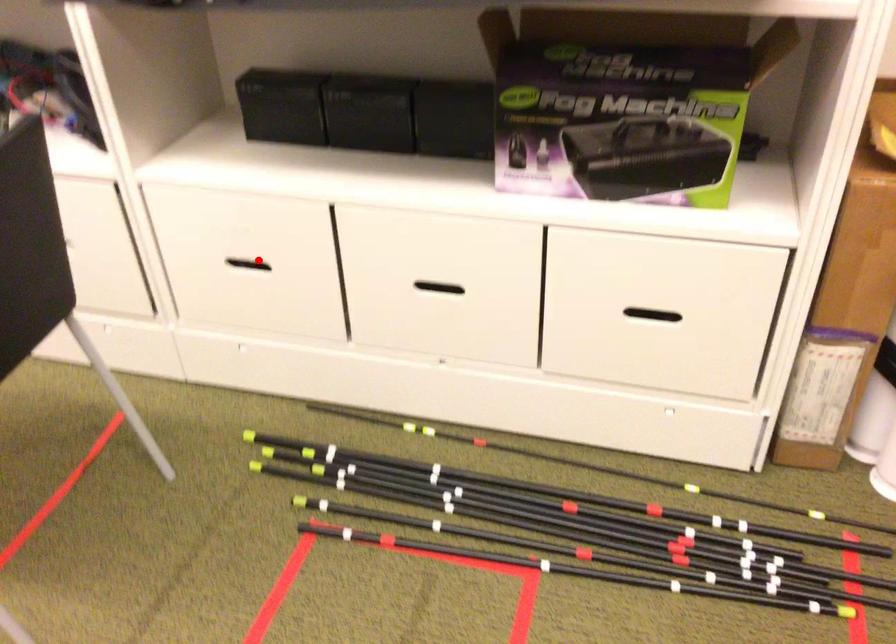
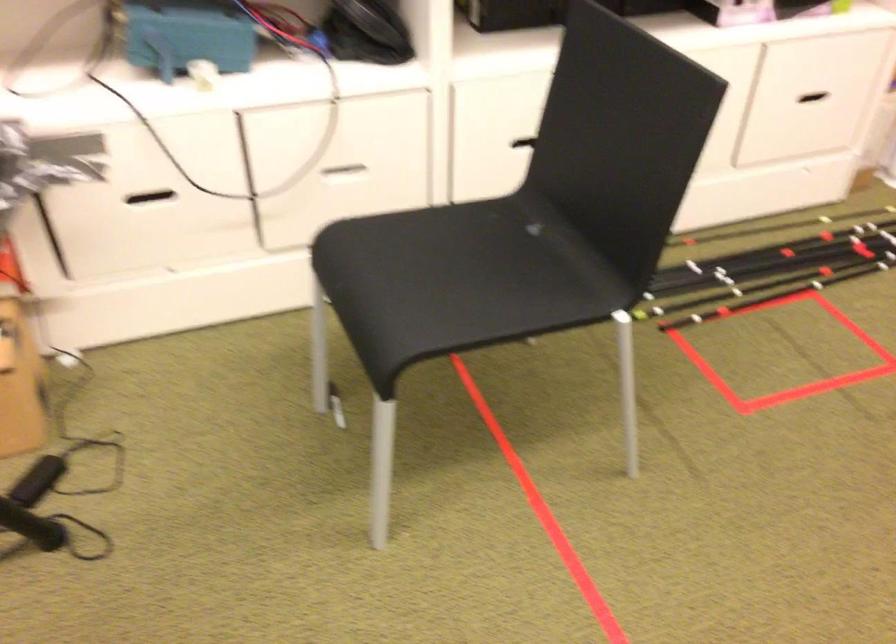
Question: I am providing you with two images of the same scene from different viewpoints. A red point is marked on the first image. Is the red point's position out of view in image 2?

Choices:
 (A) Yes
 (B) No

Answer: (A)